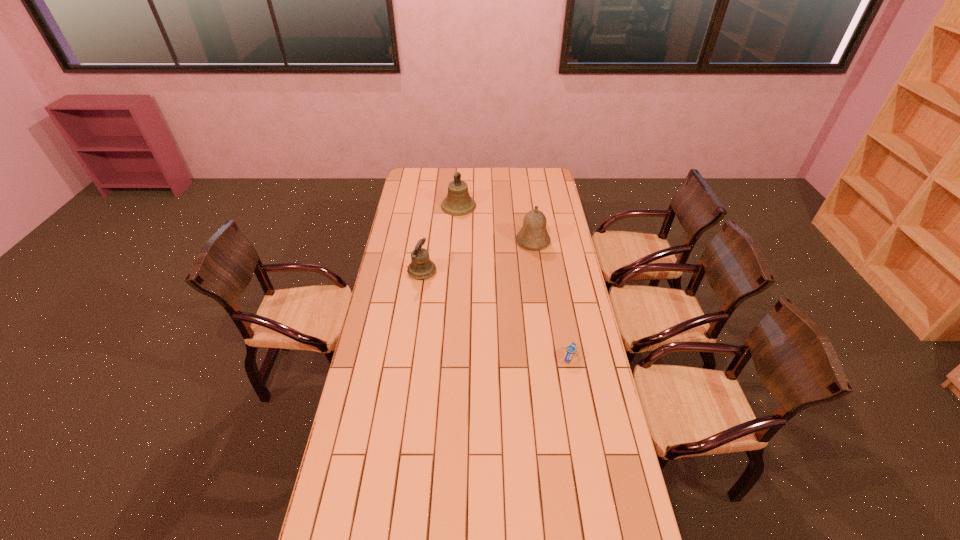
The width and height of the screenshot is (960, 540). In order to click on free space between the second nearest object and the second farthest object in this screenshot , I will do `click(477, 256)`.

In order to click on free space between the farthest object and the second farthest object in this screenshot , I will do `click(495, 224)`.

At what (x,y) coordinates should I click in order to perform the action: click on empty location between the watch and the nearest bell. Please return your answer as a coordinate pair (x, y). Image resolution: width=960 pixels, height=540 pixels. Looking at the image, I should click on (495, 314).

At what (x,y) coordinates should I click in order to perform the action: click on vacant space that is in between the watch and the third farthest object. Please return your answer as a coordinate pair (x, y). The width and height of the screenshot is (960, 540). Looking at the image, I should click on (495, 314).

This screenshot has width=960, height=540. Find the location of `vacant space that is in between the shortest bell and the second farthest bell`. vacant space that is in between the shortest bell and the second farthest bell is located at coordinates (477, 256).

At what (x,y) coordinates should I click in order to perform the action: click on blank region between the nearest object and the rightmost bell. Please return your answer as a coordinate pair (x, y). The width and height of the screenshot is (960, 540). Looking at the image, I should click on (551, 299).

Where is `free space between the rightmost bell and the third tallest object`? This screenshot has width=960, height=540. free space between the rightmost bell and the third tallest object is located at coordinates (477, 256).

Where is `object that stands as the third closest to the rightmost bell`? The height and width of the screenshot is (540, 960). object that stands as the third closest to the rightmost bell is located at coordinates (570, 349).

The height and width of the screenshot is (540, 960). What are the coordinates of `the third closest object relative to the second nearest bell` in the screenshot? It's located at (570, 349).

Locate an element on the screen. This screenshot has width=960, height=540. the second closest bell to the nearest bell is located at coordinates (533, 235).